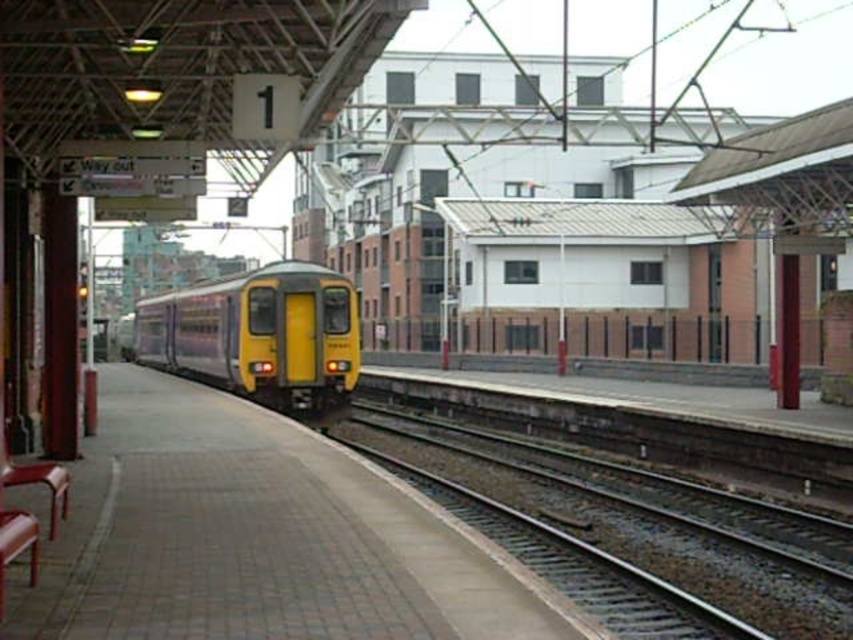
Which of these two, smooth concrete platform at center or yellow matte train at center, stands taller?

yellow matte train at center is taller.

Find the location of a particular element. This screenshot has height=640, width=853. smooth concrete platform at center is located at coordinates tap(259, 538).

Which of these two, smooth metal track at center or yellow matte train at center, stands taller?

Standing taller between the two is yellow matte train at center.

Who is more distant from viewer, (485, 504) or (254, 344)?

The point (254, 344) is behind.

In order to click on smooth metal track at center in this screenshot , I will do `click(633, 522)`.

Locate an element on the screen. The height and width of the screenshot is (640, 853). smooth concrete platform at center is located at coordinates (259, 538).

Is smooth concrete platform at center bigger than smooth metal track at center?

Incorrect, smooth concrete platform at center is not larger than smooth metal track at center.

Does point (410, 515) come closer to viewer compared to point (697, 561)?

Yes, it is.

You are a GUI agent. You are given a task and a screenshot of the screen. Output one action in this format:
    pyautogui.click(x=<x>, y=<y>)
    Task: Click on the smooth concrete platform at center
    
    Given the screenshot: What is the action you would take?
    pyautogui.click(x=259, y=538)